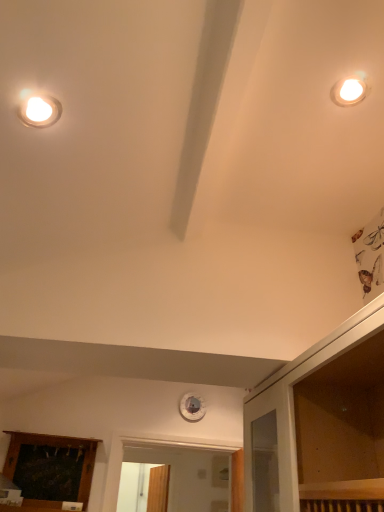
In order to face wooden panel at lower left, should I rotate leftwards or rightwards?

To align with it, rotate left about 18.478°.

Describe the element at coordinates (49, 470) in the screenshot. This screenshot has height=512, width=384. I see `wooden panel at lower left` at that location.

The height and width of the screenshot is (512, 384). Find the location of `wooden panel at lower left`. wooden panel at lower left is located at coordinates (49, 470).

You are a GUI agent. You are given a task and a screenshot of the screen. Output one action in this format:
    pyautogui.click(x=<x>, y=<y>)
    Task: Click on the transparent glass dresser at upper right
    The image size is (384, 512).
    Given the screenshot: What is the action you would take?
    pyautogui.click(x=293, y=398)

Measure the distance between transparent glass dresser at upper right and camera.

38.12 inches.

The height and width of the screenshot is (512, 384). What do you see at coordinates (293, 398) in the screenshot?
I see `transparent glass dresser at upper right` at bounding box center [293, 398].

Identify the location of wooden panel at lower left. The image size is (384, 512). (49, 470).

Which is more to the right, wooden panel at lower left or transparent glass dresser at upper right?

transparent glass dresser at upper right.

Relative to transparent glass dresser at upper right, is wooden panel at lower left in front or behind?

Clearly, wooden panel at lower left is behind transparent glass dresser at upper right.

Is point (77, 497) positioned in front of point (333, 356)?

That is False.

From the image's perspective, is wooden panel at lower left above or below transparent glass dresser at upper right?

From the image's perspective, wooden panel at lower left appears below transparent glass dresser at upper right.

From a real-world perspective, does wooden panel at lower left sit lower than transparent glass dresser at upper right?

Yes.

Can you confirm if wooden panel at lower left is thinner than transparent glass dresser at upper right?

Correct, the width of wooden panel at lower left is less than that of transparent glass dresser at upper right.

From their relative heights in the image, would you say wooden panel at lower left is taller or shorter than transparent glass dresser at upper right?

In the image, wooden panel at lower left appears to be taller than transparent glass dresser at upper right.

Which of these two, wooden panel at lower left or transparent glass dresser at upper right, is smaller?

wooden panel at lower left is smaller.

Is transparent glass dresser at upper right a part of wooden panel at lower left?

No, transparent glass dresser at upper right is not a part of wooden panel at lower left.

Is wooden panel at lower left touching transparent glass dresser at upper right?

A: No, wooden panel at lower left is not with transparent glass dresser at upper right.

Could you tell me if wooden panel at lower left is turned towards transparent glass dresser at upper right?

No, wooden panel at lower left does not turn towards transparent glass dresser at upper right.

In order to click on elevator lying behind the transparent glass dresser at upper right in this screenshot , I will do `click(49, 470)`.

Is transparent glass dresser at upper right at the left side of wooden panel at lower left?

No.

From the picture: Which object is more forward, transparent glass dresser at upper right or wooden panel at lower left?

transparent glass dresser at upper right.

Is point (363, 312) behind point (34, 469)?

No, it is in front of (34, 469).

From the image's perspective, is transparent glass dresser at upper right above or below wooden panel at lower left?

transparent glass dresser at upper right is situated higher than wooden panel at lower left in the image.

From a real-world perspective, is transparent glass dresser at upper right beneath wooden panel at lower left?

No, from a real-world perspective, transparent glass dresser at upper right is not beneath wooden panel at lower left.

Can you confirm if transparent glass dresser at upper right is thinner than wooden panel at lower left?

No, transparent glass dresser at upper right is not thinner than wooden panel at lower left.

Does transparent glass dresser at upper right have a lesser height compared to wooden panel at lower left?

Indeed, transparent glass dresser at upper right has a lesser height compared to wooden panel at lower left.

Which of these two, transparent glass dresser at upper right or wooden panel at lower left, is bigger?

transparent glass dresser at upper right.

Is transparent glass dresser at upper right inside the boundaries of wooden panel at lower left, or outside?

transparent glass dresser at upper right cannot be found inside wooden panel at lower left.

Would you say transparent glass dresser at upper right is a long distance from wooden panel at lower left?

Absolutely, transparent glass dresser at upper right is distant from wooden panel at lower left.

Is transparent glass dresser at upper right facing away from wooden panel at lower left?

transparent glass dresser at upper right is not turned away from wooden panel at lower left.

Can you tell me how much transparent glass dresser at upper right and wooden panel at lower left differ in facing direction?

89.1 degrees separate the facing orientations of transparent glass dresser at upper right and wooden panel at lower left.

You are a GUI agent. You are given a task and a screenshot of the screen. Output one action in this format:
    pyautogui.click(x=<x>, y=<y>)
    Task: Click on the elevator that is under the transparent glass dresser at upper right (from a real-world perspective)
    This screenshot has width=384, height=512.
    Given the screenshot: What is the action you would take?
    pyautogui.click(x=49, y=470)

Identify the location of elevator behind the transparent glass dresser at upper right. (49, 470).

The height and width of the screenshot is (512, 384). What are the coordinates of `elevator below the transparent glass dresser at upper right (from the image's perspective)` in the screenshot? It's located at (49, 470).